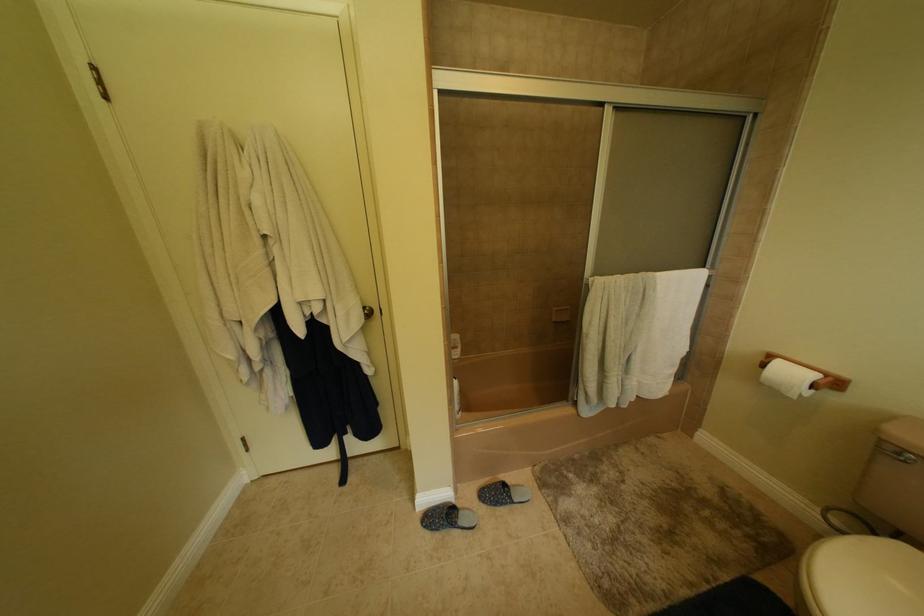
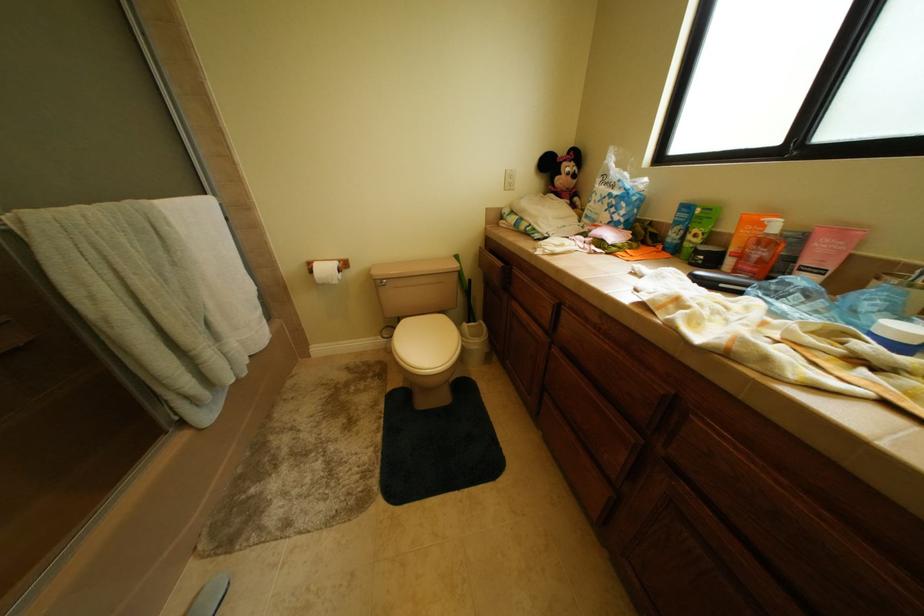
Based on the continuous images, in which direction is the camera rotating?

The camera's rotation is toward right-down.